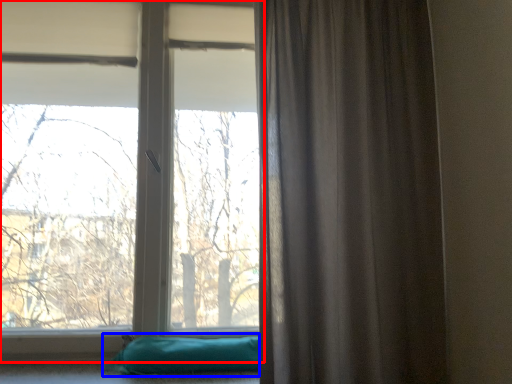
Question: Which point is further to the camera, window (highlighted by a red box) or pillow (highlighted by a blue box)?

Choices:
 (A) window
 (B) pillow

Answer: (A)